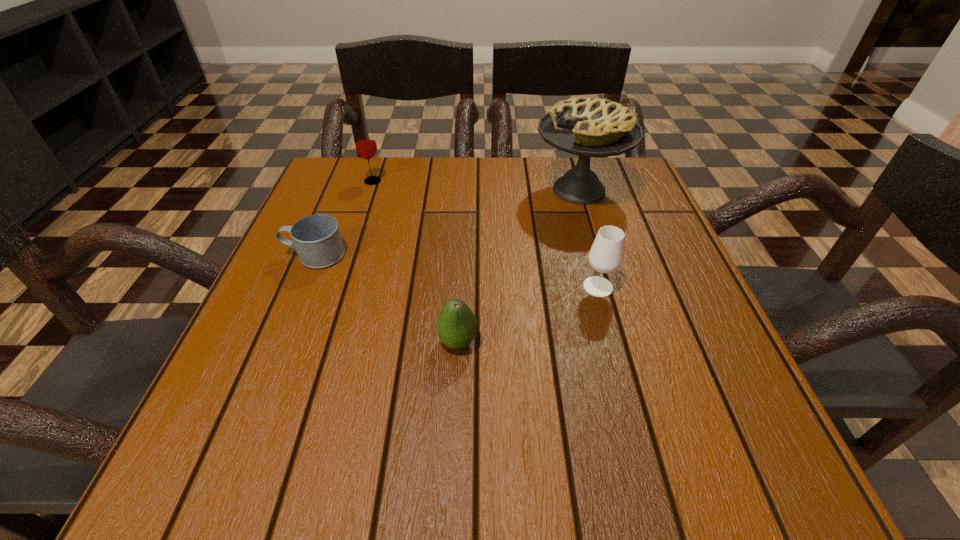
Locate an element on the screen. vacant space that satisfies the following two spatial constraints: 1. on the front side of the second shortest object; 2. on the right side of the farther glass is located at coordinates (321, 342).

Identify the location of vacant area in the image that satisfies the following two spatial constraints: 1. on the back side of the nearer glass; 2. on the side of the third nearest object with the handle. (589, 255).

You are a GUI agent. You are given a task and a screenshot of the screen. Output one action in this format:
    pyautogui.click(x=<x>, y=<y>)
    Task: Click on the vacant space that satisfies the following two spatial constraints: 1. on the front side of the farther glass; 2. on the right side of the avocado
    This screenshot has height=540, width=960.
    Given the screenshot: What is the action you would take?
    tap(321, 342)

The width and height of the screenshot is (960, 540). Identify the location of vacant space that satisfies the following two spatial constraints: 1. on the side of the third nearest object with the handle; 2. on the left side of the fourth tallest object. (279, 342).